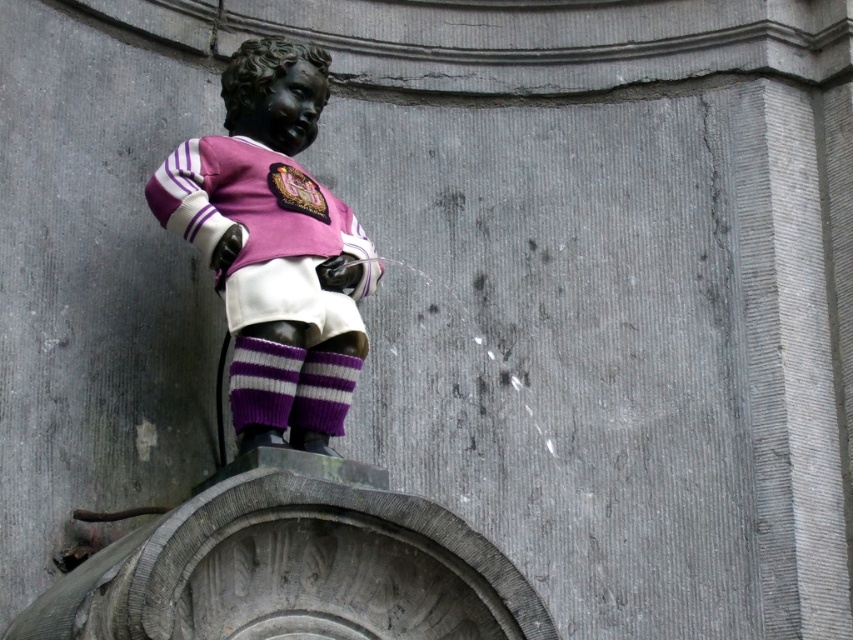
Which is more to the left, matte bronze statue at center or polished bronze statue at center?

matte bronze statue at center

Does matte bronze statue at center appear over polished bronze statue at center?

No, matte bronze statue at center is not above polished bronze statue at center.

The image size is (853, 640). In order to click on matte bronze statue at center in this screenshot , I will do `click(283, 424)`.

Locate an element on the screen. The height and width of the screenshot is (640, 853). matte bronze statue at center is located at coordinates (x=283, y=424).